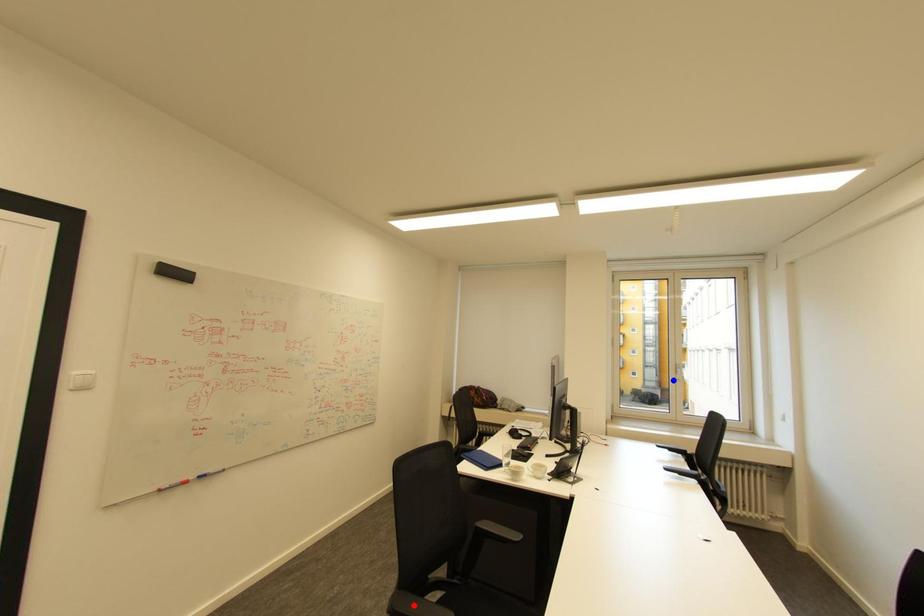
Question: Two points are marked on the image. Which point is closer to the camera?

Choices:
 (A) Blue point is closer.
 (B) Red point is closer.

Answer: (B)